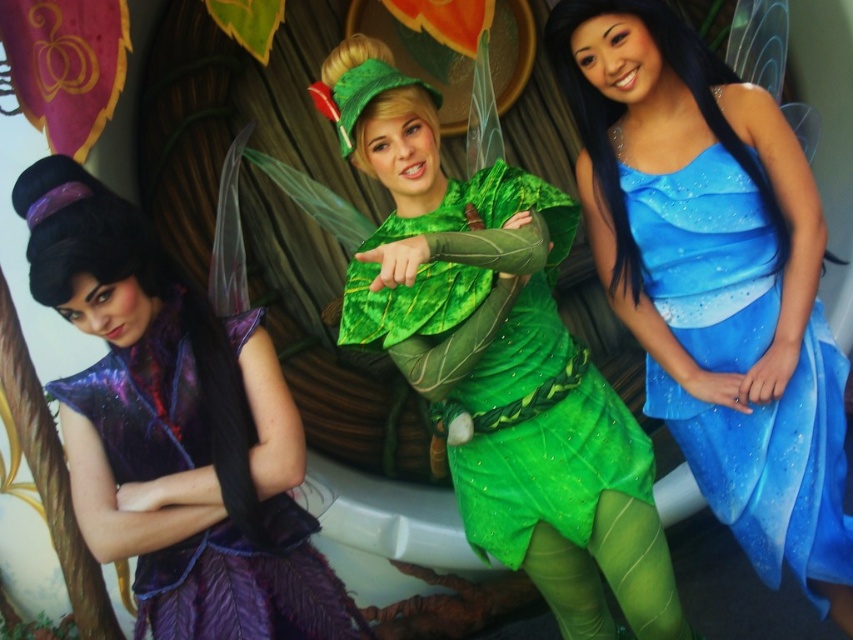
Is blue satin dress at center positioned before purple satin dress at left?

No, it is behind purple satin dress at left.

You are a GUI agent. You are given a task and a screenshot of the screen. Output one action in this format:
    pyautogui.click(x=<x>, y=<y>)
    Task: Click on the blue satin dress at center
    
    Given the screenshot: What is the action you would take?
    pyautogui.click(x=715, y=278)

At what (x,y) coordinates should I click in order to perform the action: click on blue satin dress at center. Please return your answer as a coordinate pair (x, y). Looking at the image, I should click on (715, 278).

Can you confirm if blue satin dress at center is positioned to the left of green leafy costume at center?

No, blue satin dress at center is not to the left of green leafy costume at center.

Who is higher up, blue satin dress at center or green leafy costume at center?

green leafy costume at center is above.

What do you see at coordinates (715, 278) in the screenshot?
I see `blue satin dress at center` at bounding box center [715, 278].

You are a GUI agent. You are given a task and a screenshot of the screen. Output one action in this format:
    pyautogui.click(x=<x>, y=<y>)
    Task: Click on the blue satin dress at center
    
    Given the screenshot: What is the action you would take?
    click(715, 278)

Can you confirm if green leafy costume at center is bigger than purple satin dress at left?

Yes, green leafy costume at center is bigger than purple satin dress at left.

Between point (376, 326) and point (250, 545), which one is positioned behind?

The point (376, 326) is more distant.

You are a GUI agent. You are given a task and a screenshot of the screen. Output one action in this format:
    pyautogui.click(x=<x>, y=<y>)
    Task: Click on the green leafy costume at center
    This screenshot has height=640, width=853.
    Given the screenshot: What is the action you would take?
    coord(498,358)

Find the location of a particular element. This screenshot has height=640, width=853. green leafy costume at center is located at coordinates (498, 358).